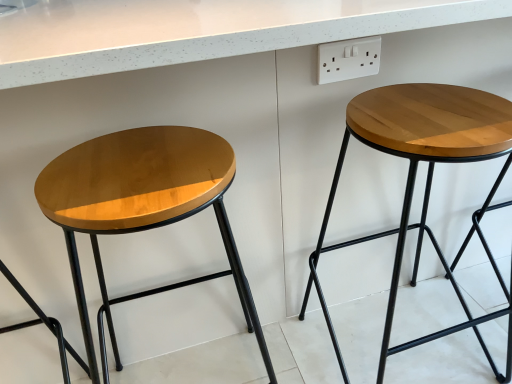
Measure the distance between glossy wood stool at left, the 1th stool viewed from the left, and camera.

The depth of glossy wood stool at left, the 1th stool viewed from the left, is 21.99 inches.

The width and height of the screenshot is (512, 384). Describe the element at coordinates (426, 180) in the screenshot. I see `wooden stool at right, which appears as the second stool when viewed from the left` at that location.

Describe the element at coordinates (348, 59) in the screenshot. The image size is (512, 384). I see `white plastic socket at upper right` at that location.

I want to click on glossy wood stool at left, the 1th stool viewed from the left, so click(142, 207).

Which is more to the right, wooden stool at right, which appears as the second stool when viewed from the left, or glossy wood stool at left, the 1th stool viewed from the left?

Positioned to the right is wooden stool at right, which appears as the second stool when viewed from the left.

Considering the relative sizes of wooden stool at right, which appears as the second stool when viewed from the left, and glossy wood stool at left, the 1th stool viewed from the left, in the image provided, is wooden stool at right, which appears as the second stool when viewed from the left, wider than glossy wood stool at left, the 1th stool viewed from the left,?

Yes.

From a real-world perspective, between wooden stool at right, which appears as the second stool when viewed from the left, and glossy wood stool at left, the 1th stool viewed from the left, who is vertically lower?

wooden stool at right, which appears as the second stool when viewed from the left, from a real-world perspective.

Is the surface of wooden stool at right, which appears as the second stool when viewed from the left, in direct contact with glossy wood stool at left, positioned as the second stool in right-to-left order?

No, wooden stool at right, which appears as the second stool when viewed from the left, is not beside glossy wood stool at left, positioned as the second stool in right-to-left order.

How different are the orientations of glossy wood stool at left, positioned as the second stool in right-to-left order, and white plastic socket at upper right in degrees?

The angle between the facing direction of glossy wood stool at left, positioned as the second stool in right-to-left order, and the facing direction of white plastic socket at upper right is 180 degrees.

From a real-world perspective, who is located higher, glossy wood stool at left, the 1th stool viewed from the left, or white plastic socket at upper right?

From a 3D spatial view, white plastic socket at upper right is above.

From the image's perspective, is glossy wood stool at left, positioned as the second stool in right-to-left order, below white plastic socket at upper right?

Yes, from the image's perspective, glossy wood stool at left, positioned as the second stool in right-to-left order, is below white plastic socket at upper right.

Is white plastic socket at upper right at the back of glossy wood stool at left, the 1th stool viewed from the left?

No, glossy wood stool at left, the 1th stool viewed from the left, is not facing away from white plastic socket at upper right.

Would you say white plastic socket at upper right is to the left or to the right of wooden stool at right, which appears as the second stool when viewed from the left, in the picture?

From the image, it's evident that white plastic socket at upper right is to the left of wooden stool at right, which appears as the second stool when viewed from the left.

Could you tell me if white plastic socket at upper right is facing wooden stool at right, which is the first stool from right to left?

No, white plastic socket at upper right is not turned towards wooden stool at right, which is the first stool from right to left.

Is white plastic socket at upper right not within wooden stool at right, which is the first stool from right to left?

white plastic socket at upper right lies outside wooden stool at right, which is the first stool from right to left,'s area.

From the image's perspective, is white plastic socket at upper right located beneath wooden stool at right, which is the first stool from right to left?

No, from the image's perspective, white plastic socket at upper right is not below wooden stool at right, which is the first stool from right to left.

Can you confirm if glossy wood stool at left, the 1th stool viewed from the left, is shorter than wooden stool at right, which is the first stool from right to left?

Incorrect, the height of glossy wood stool at left, the 1th stool viewed from the left, does not fall short of that of wooden stool at right, which is the first stool from right to left.

In terms of width, does glossy wood stool at left, positioned as the second stool in right-to-left order, look wider or thinner when compared to wooden stool at right, which appears as the second stool when viewed from the left?

glossy wood stool at left, positioned as the second stool in right-to-left order, is thinner than wooden stool at right, which appears as the second stool when viewed from the left.

In the scene shown: From a real-world perspective, who is located higher, glossy wood stool at left, positioned as the second stool in right-to-left order, or wooden stool at right, which is the first stool from right to left?

From a 3D spatial view, glossy wood stool at left, positioned as the second stool in right-to-left order, is above.

How many degrees apart are the facing directions of glossy wood stool at left, the 1th stool viewed from the left, and wooden stool at right, which appears as the second stool when viewed from the left?

7.73e-05 degrees separate the facing orientations of glossy wood stool at left, the 1th stool viewed from the left, and wooden stool at right, which appears as the second stool when viewed from the left.

From the image's perspective, between white plastic socket at upper right and glossy wood stool at left, positioned as the second stool in right-to-left order, who is located below?

glossy wood stool at left, positioned as the second stool in right-to-left order, is shown below in the image.

This screenshot has width=512, height=384. In order to click on electric outlet that appears behind the glossy wood stool at left, positioned as the second stool in right-to-left order in this screenshot , I will do `click(348, 59)`.

Considering the positions of points (319, 53) and (150, 177), is point (319, 53) closer to camera compared to point (150, 177)?

That is False.

Does white plastic socket at upper right have a lesser width compared to glossy wood stool at left, the 1th stool viewed from the left?

Yes, white plastic socket at upper right is thinner than glossy wood stool at left, the 1th stool viewed from the left.

Could you tell me if wooden stool at right, which is the first stool from right to left, is turned towards white plastic socket at upper right?

No, wooden stool at right, which is the first stool from right to left, is not aimed at white plastic socket at upper right.

From a real-world perspective, is wooden stool at right, which is the first stool from right to left, physically located above or below white plastic socket at upper right?

In terms of real-world spatial position, wooden stool at right, which is the first stool from right to left, is below white plastic socket at upper right.

Which object is more forward, wooden stool at right, which appears as the second stool when viewed from the left, or white plastic socket at upper right?

wooden stool at right, which appears as the second stool when viewed from the left.

Does wooden stool at right, which appears as the second stool when viewed from the left, have a lesser width compared to white plastic socket at upper right?

No, wooden stool at right, which appears as the second stool when viewed from the left, is not thinner than white plastic socket at upper right.

Locate an element on the screen. stool located above the wooden stool at right, which is the first stool from right to left (from a real-world perspective) is located at coordinates (142, 207).

This screenshot has height=384, width=512. I want to click on electric outlet behind the glossy wood stool at left, the 1th stool viewed from the left, so click(x=348, y=59).

Looking at the image, which one is located closer to white plastic socket at upper right, wooden stool at right, which is the first stool from right to left, or glossy wood stool at left, positioned as the second stool in right-to-left order?

wooden stool at right, which is the first stool from right to left.

Considering their positions, is glossy wood stool at left, positioned as the second stool in right-to-left order, positioned closer to white plastic socket at upper right than wooden stool at right, which appears as the second stool when viewed from the left?

Among the two, wooden stool at right, which appears as the second stool when viewed from the left, is located nearer to white plastic socket at upper right.

Considering their positions, is white plastic socket at upper right positioned further to wooden stool at right, which is the first stool from right to left, than glossy wood stool at left, positioned as the second stool in right-to-left order?

The object further to wooden stool at right, which is the first stool from right to left, is glossy wood stool at left, positioned as the second stool in right-to-left order.

Considering their positions, is white plastic socket at upper right positioned closer to glossy wood stool at left, positioned as the second stool in right-to-left order, than wooden stool at right, which appears as the second stool when viewed from the left?

white plastic socket at upper right lies closer to glossy wood stool at left, positioned as the second stool in right-to-left order, than the other object.

When comparing their distances from wooden stool at right, which appears as the second stool when viewed from the left, does glossy wood stool at left, the 1th stool viewed from the left, or white plastic socket at upper right seem closer?

white plastic socket at upper right is positioned closer to the anchor wooden stool at right, which appears as the second stool when viewed from the left.

Considering their positions, is wooden stool at right, which is the first stool from right to left, positioned further to glossy wood stool at left, the 1th stool viewed from the left, than white plastic socket at upper right?

The object further to glossy wood stool at left, the 1th stool viewed from the left, is wooden stool at right, which is the first stool from right to left.

Locate an element on the screen. stool that lies between white plastic socket at upper right and glossy wood stool at left, positioned as the second stool in right-to-left order, from top to bottom is located at coordinates (426, 180).